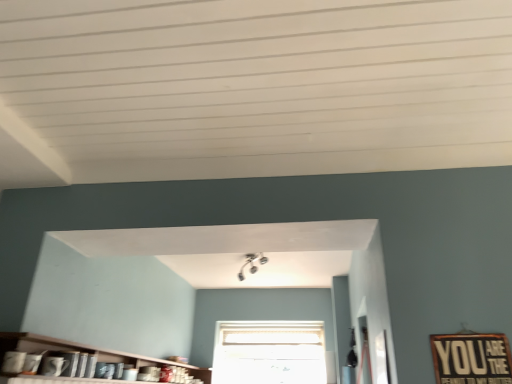
Question: Considering the positions of matte wooden shelf at lower left and white frosted glass window at center in the image, is matte wooden shelf at lower left wider or thinner than white frosted glass window at center?

Choices:
 (A) wide
 (B) thin

Answer: (A)

Question: Which is correct: matte wooden shelf at lower left is inside white frosted glass window at center, or outside of it?

Choices:
 (A) outside
 (B) inside

Answer: (A)

Question: Is matte wooden shelf at lower left to the left or to the right of white frosted glass window at center in the image?

Choices:
 (A) left
 (B) right

Answer: (A)

Question: Is white frosted glass window at center taller or shorter than matte wooden shelf at lower left?

Choices:
 (A) short
 (B) tall

Answer: (B)

Question: Is white frosted glass window at center wider or thinner than matte wooden shelf at lower left?

Choices:
 (A) thin
 (B) wide

Answer: (A)

Question: Is point (318, 349) positioned closer to the camera than point (37, 334)?

Choices:
 (A) closer
 (B) farther

Answer: (B)

Question: In the image, is white frosted glass window at center positioned in front of or behind matte wooden shelf at lower left?

Choices:
 (A) front
 (B) behind

Answer: (B)